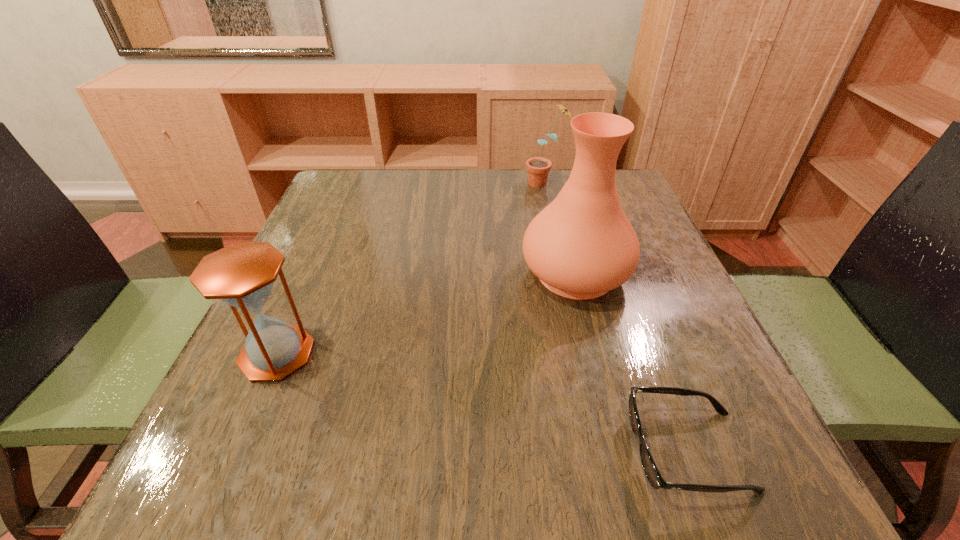
This screenshot has height=540, width=960. Find the location of `the tallest object`. the tallest object is located at coordinates click(582, 245).

Locate an element on the screen. the third nearest object is located at coordinates (582, 245).

Identify the location of the farthest object. (538, 168).

Find the location of a particular element. The image size is (960, 540). hourglass is located at coordinates coord(242,275).

Where is `the leftmost object`? This screenshot has height=540, width=960. the leftmost object is located at coordinates (242, 275).

At what (x,y) coordinates should I click in order to perform the action: click on spectacles. Please return your answer as a coordinate pair (x, y). This screenshot has height=540, width=960. Looking at the image, I should click on (652, 473).

Identify the location of the nearest object. This screenshot has width=960, height=540. (652, 473).

The image size is (960, 540). I want to click on free space located on the front of the tallest object, so click(592, 341).

Locate an element on the screen. The image size is (960, 540). vacant space located on the flower of the farthest object is located at coordinates (432, 183).

Identify the location of vacant space located 0.160m on the flower of the farthest object. The image size is (960, 540). (466, 183).